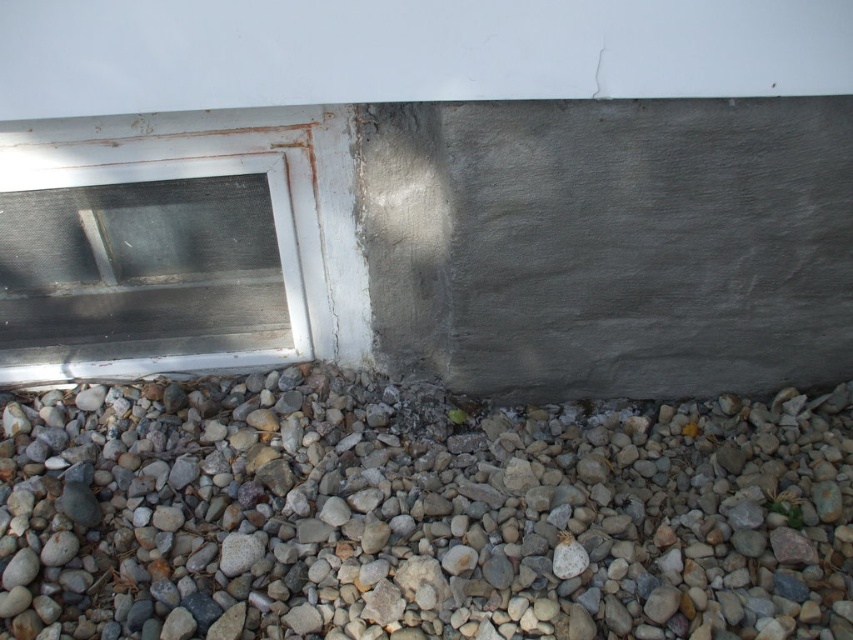
Question: Is gray gravel at lower center below white plastic window at lower left?

Choices:
 (A) yes
 (B) no

Answer: (A)

Question: Is gray gravel at lower center in front of white plastic window at lower left?

Choices:
 (A) no
 (B) yes

Answer: (B)

Question: Among these objects, which one is nearest to the camera?

Choices:
 (A) white plastic window at lower left
 (B) gray gravel at lower center

Answer: (B)

Question: Which point is closer to the camera taking this photo?

Choices:
 (A) (566, 637)
 (B) (250, 259)

Answer: (A)

Question: Is gray gravel at lower center positioned behind white plastic window at lower left?

Choices:
 (A) yes
 (B) no

Answer: (B)